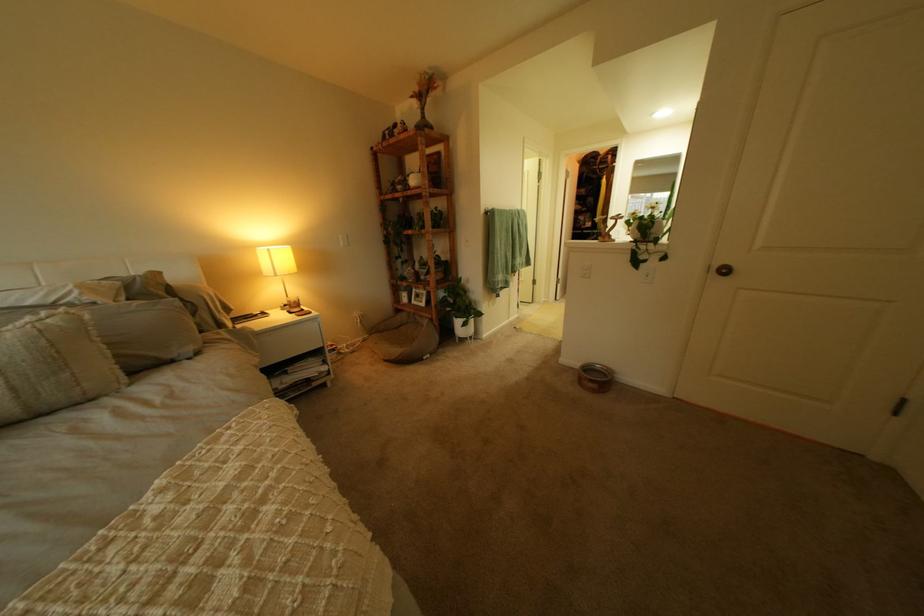
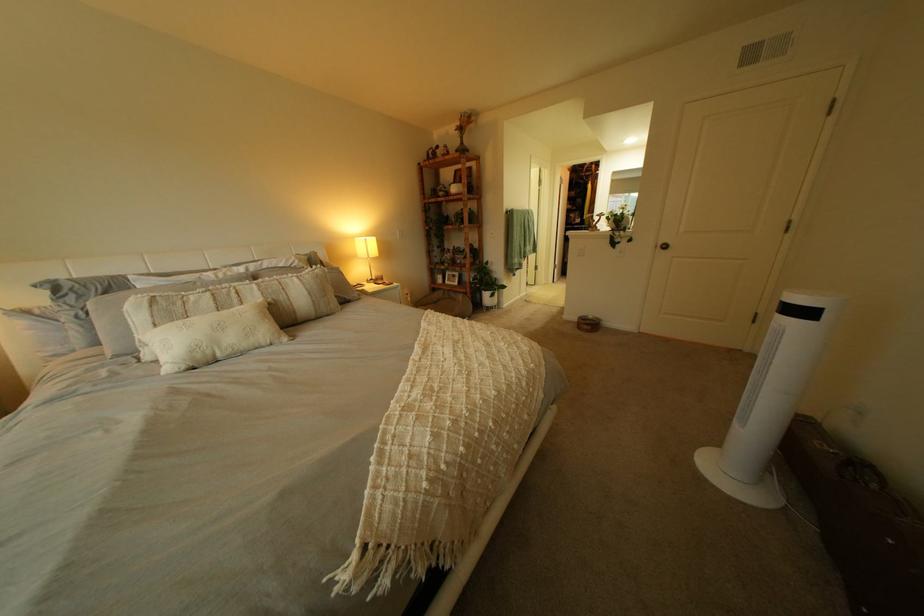
What movement of the cameraman would produce the second image?

The cameraman walked toward left, backward.